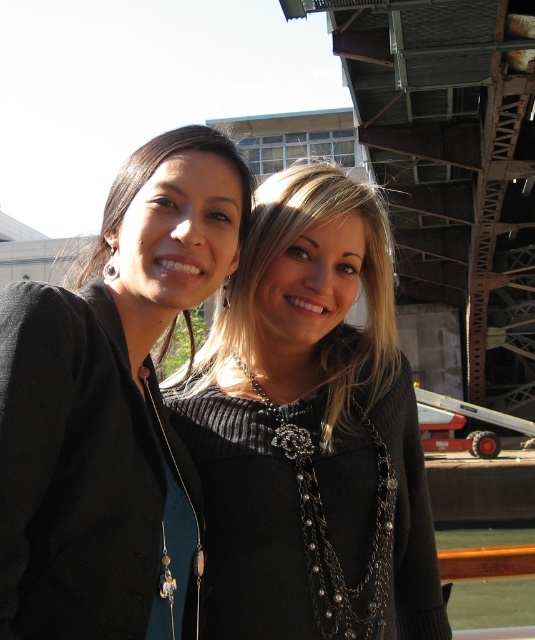
Does matte black sweater at center have a lesser height compared to matte black sweater at upper left?

No.

Can you confirm if matte black sweater at center is taller than matte black sweater at upper left?

Yes.

Find the location of a particular element. The height and width of the screenshot is (640, 535). matte black sweater at center is located at coordinates (310, 432).